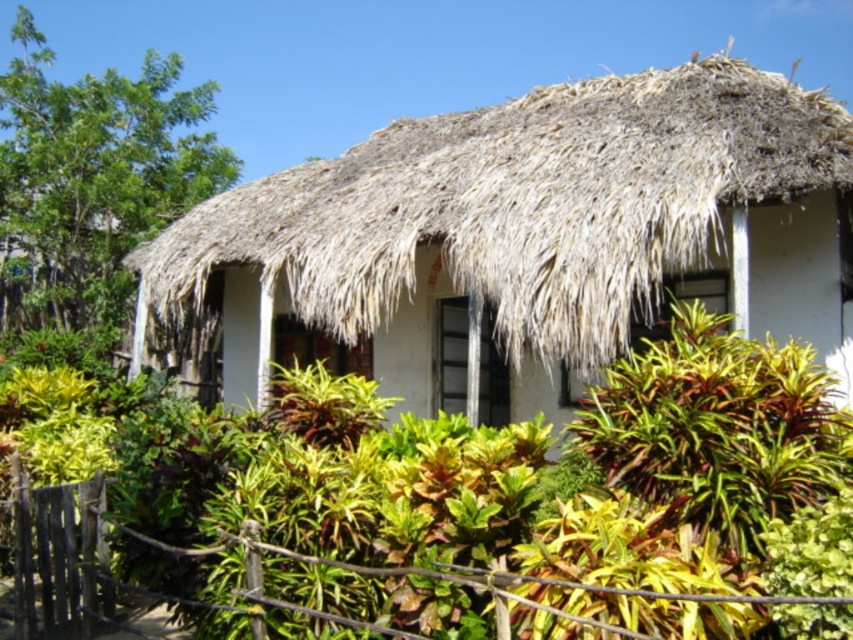
Is green leafy tree at upper left above wooden fence at lower center?

Indeed, green leafy tree at upper left is positioned over wooden fence at lower center.

Which is above, green leafy tree at upper left or wooden fence at lower center?

green leafy tree at upper left

Between point (85, 300) and point (347, 621), which one is positioned in front?

Point (347, 621) is more forward.

Identify the location of green leafy tree at upper left. [91, 179].

Is point (756, 333) positioned after point (38, 513)?

Yes, point (756, 333) is farther from viewer.

Is white thatch hut at center bigger than wooden fence at lower center?

Correct, white thatch hut at center is larger in size than wooden fence at lower center.

Is point (401, 380) behind point (218, 608)?

Yes, point (401, 380) is behind point (218, 608).

This screenshot has width=853, height=640. What are the coordinates of `white thatch hut at center` in the screenshot? It's located at (529, 240).

Is white thatch hut at center bigger than green leafy tree at upper left?

No, white thatch hut at center is not bigger than green leafy tree at upper left.

Which is behind, point (438, 300) or point (18, 129)?

The point (18, 129) is more distant.

Is point (724, 129) positioned before point (140, 148)?

Yes, it is.

At what (x,y) coordinates should I click in order to perform the action: click on white thatch hut at center. Please return your answer as a coordinate pair (x, y). Looking at the image, I should click on (529, 240).